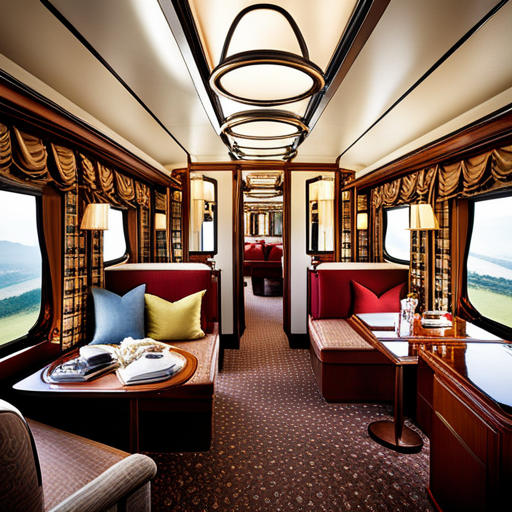
Find the location of a particular element. The image size is (512, 512). tables is located at coordinates (108, 379), (399, 352).